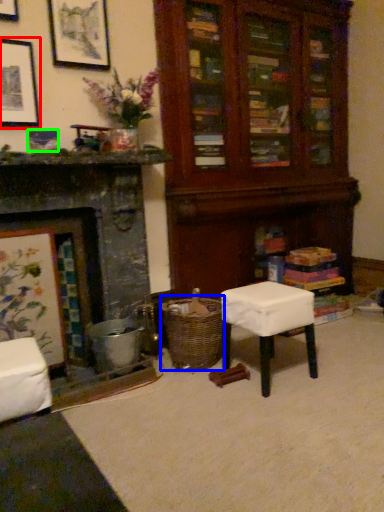
Question: Which object is positioned closest to picture frame (highlighted by a red box)? Select from crate (highlighted by a blue box) and picture frame (highlighted by a green box).

Choices:
 (A) crate
 (B) picture frame

Answer: (B)